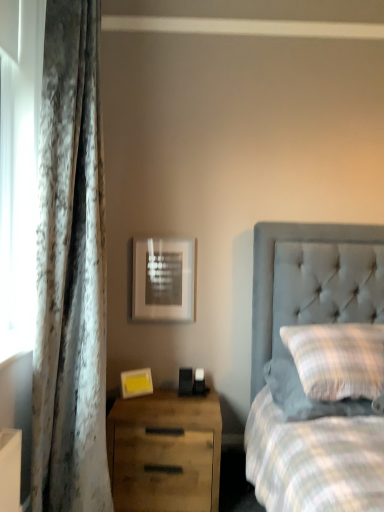
Question: In terms of width, does wooden drawer at lower left look wider or thinner when compared to matte silver picture frame at upper center, the 1th picture frame in the back-to-front sequence?

Choices:
 (A) thin
 (B) wide

Answer: (B)

Question: From the image's perspective, relative to matte silver picture frame at upper center, which appears as the 2th picture frame when ordered from the bottom, is wooden drawer at lower left above or below?

Choices:
 (A) below
 (B) above

Answer: (A)

Question: Which object is the closest to the plaid fabric pillow at right?

Choices:
 (A) velvet curtain at left
 (B) wooden drawer at lower left
 (C) matte silver picture frame at upper center, which ranks as the 2th picture frame in front-to-back order
 (D) yellow matte picture frame at lower left, acting as the first picture frame starting from the bottom

Answer: (B)

Question: Estimate the real-world distances between objects in this image. Which object is closer to the velvet curtain at left?

Choices:
 (A) wooden drawer at lower left
 (B) yellow matte picture frame at lower left, acting as the second picture frame starting from the back
 (C) matte silver picture frame at upper center, the 1th picture frame when ordered from top to bottom
 (D) plaid fabric pillow at right

Answer: (A)